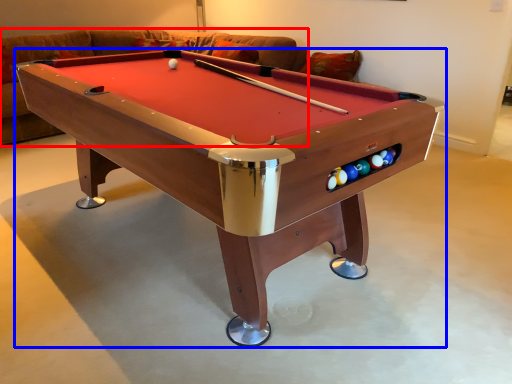
Question: Among these objects, which one is farthest to the camera, couch (highlighted by a red box) or billiard table (highlighted by a blue box)?

Choices:
 (A) couch
 (B) billiard table

Answer: (A)